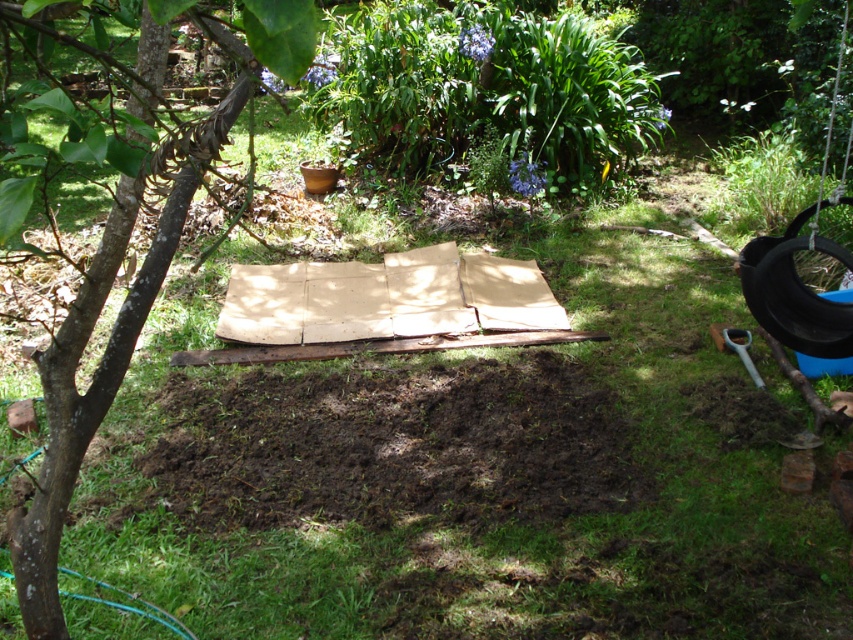
Question: Which point appears farthest from the camera in this image?

Choices:
 (A) (28, 541)
 (B) (796, 214)

Answer: (B)

Question: Which point is closer to the camera taking this photo?

Choices:
 (A) (47, 534)
 (B) (831, 257)

Answer: (A)

Question: Is brown rough tree at left above black rubber tire at right?

Choices:
 (A) yes
 (B) no

Answer: (B)

Question: Which of the following is the closest to the observer?

Choices:
 (A) brown rough tree at left
 (B) black rubber tire at right

Answer: (A)

Question: From the image, what is the correct spatial relationship of brown rough tree at left in relation to black rubber tire at right?

Choices:
 (A) below
 (B) above

Answer: (A)

Question: Does brown rough tree at left have a lesser width compared to black rubber tire at right?

Choices:
 (A) no
 (B) yes

Answer: (A)